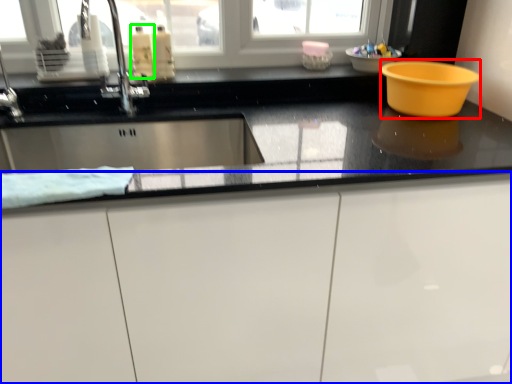
Question: Based on their relative distances, which object is nearer to basin (highlighted by a red box)? Choose from cabinetry (highlighted by a blue box) and liquid (highlighted by a green box).

Choices:
 (A) cabinetry
 (B) liquid

Answer: (A)